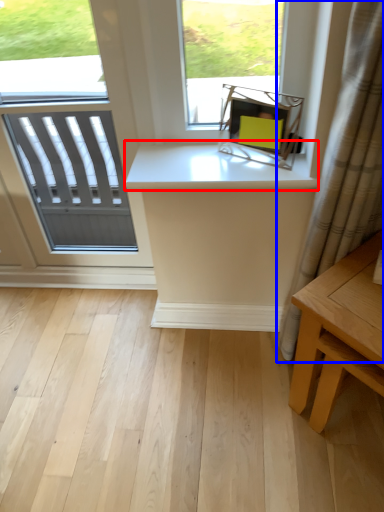
Question: Among these objects, which one is nearest to the camera, counter top (highlighted by a red box) or curtain (highlighted by a blue box)?

Choices:
 (A) counter top
 (B) curtain

Answer: (B)